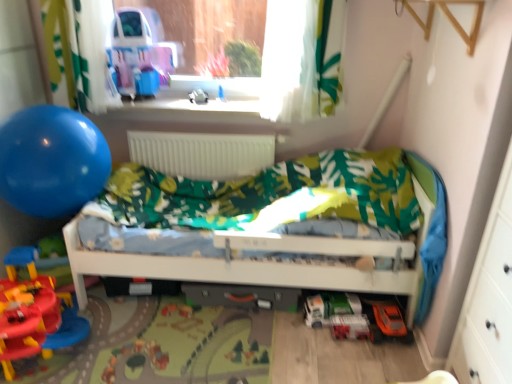
Where is `vacant space to the left of white plastic toy at center, which ranks as the 1th toy in back-to-front order`? Image resolution: width=512 pixels, height=384 pixels. vacant space to the left of white plastic toy at center, which ranks as the 1th toy in back-to-front order is located at coordinates (172, 100).